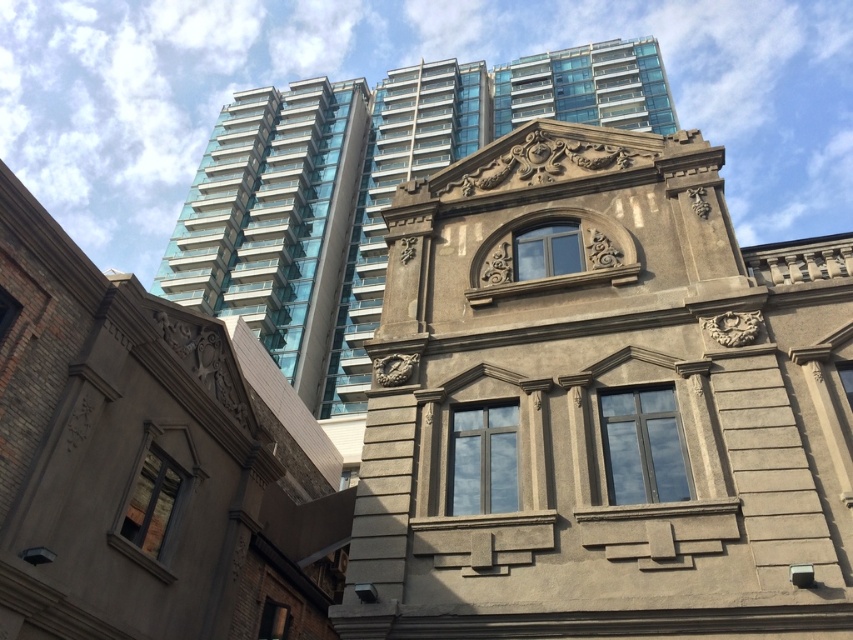
You are an architect analyzing the image. Which building, the smooth concrete building at center or the glassy blue skyscraper at upper center, would require more structural support due to its height?

The glassy blue skyscraper at upper center requires more structural support because it is taller than the smooth concrete building at center.

You are an architect evaluating the spatial compatibility between the smooth concrete building at center and the gold textured clock at center. Which object is taller?

The smooth concrete building at center is taller than the gold textured clock at center.

You are standing in front of the two buildings and want to take a photo that includes both the glassy blue skyscraper at upper center and the gold textured clock at center. Which building should you focus on first to ensure both are in focus?

You should focus on the gold textured clock at center first because the glassy blue skyscraper at upper center is further away, so focusing on the closer object ensures both are in focus.